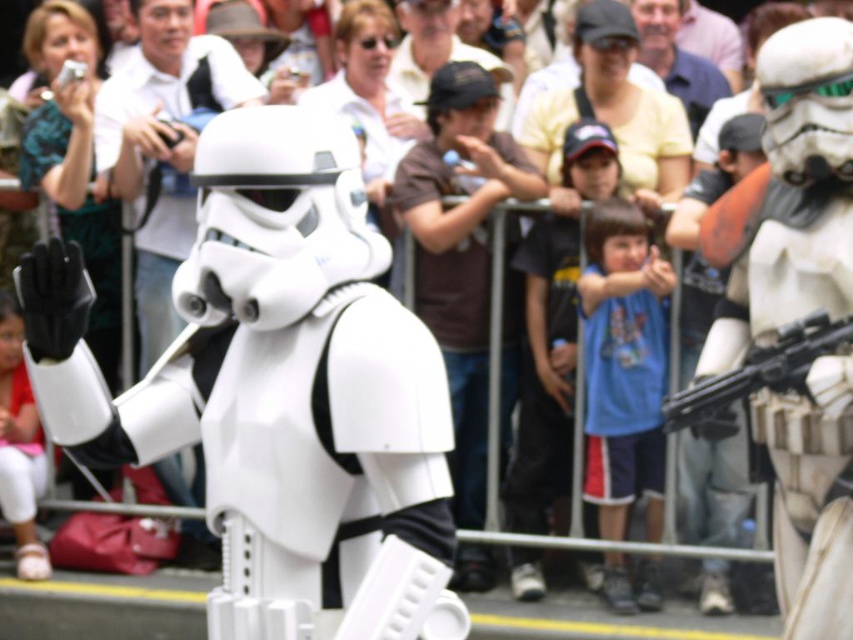
Question: In this image, where is brown cotton t-shirt at center located relative to white matte helmet at center?

Choices:
 (A) right
 (B) left

Answer: (A)

Question: Which of the following is the closest to the observer?

Choices:
 (A) (651, 346)
 (B) (488, 113)

Answer: (A)

Question: Is blue cotton shirt at center positioned in front of matte black gun at right?

Choices:
 (A) no
 (B) yes

Answer: (A)

Question: Does white matte stormtrooper at center have a smaller size compared to blue cotton shirt at center?

Choices:
 (A) no
 (B) yes

Answer: (A)

Question: Which point is closer to the camera?

Choices:
 (A) white matte stormtrooper at center
 (B) matte black gun at right

Answer: (A)

Question: Based on their relative distances, which object is nearer to the white matte helmet at center?

Choices:
 (A) blue cotton shirt at center
 (B) brown cotton t-shirt at center
 (C) white matte stormtrooper at center
 (D) matte black gun at right

Answer: (B)